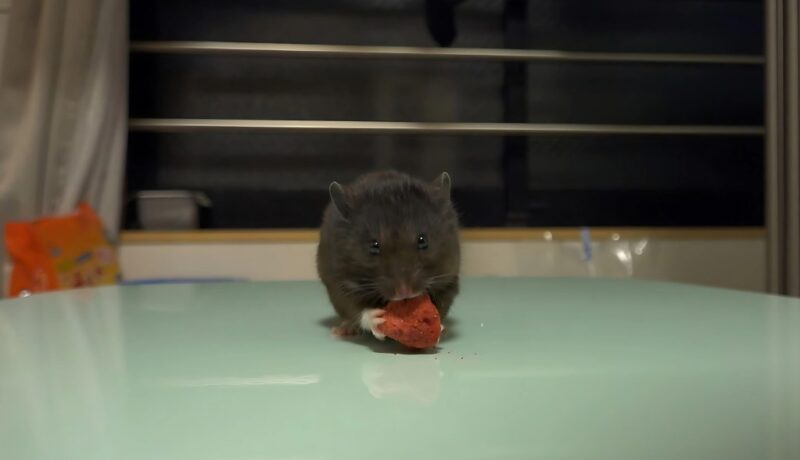
The width and height of the screenshot is (800, 460). In order to click on mouse in this screenshot , I will do `click(406, 225)`.